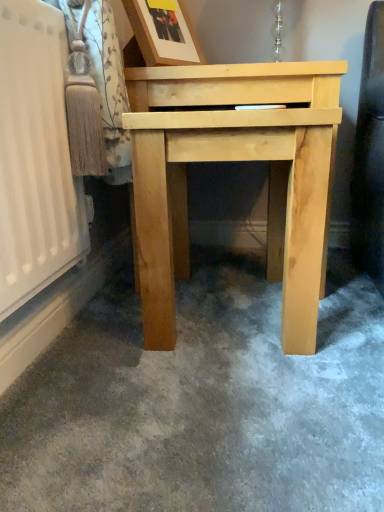
Question: In the image, is wooden picture frame at upper center positioned in front of or behind natural wood table at center?

Choices:
 (A) behind
 (B) front

Answer: (A)

Question: Is wooden picture frame at upper center inside or outside of natural wood table at center?

Choices:
 (A) outside
 (B) inside

Answer: (A)

Question: In terms of width, does wooden picture frame at upper center look wider or thinner when compared to natural wood table at center?

Choices:
 (A) thin
 (B) wide

Answer: (A)

Question: In terms of size, does natural wood table at center appear bigger or smaller than wooden picture frame at upper center?

Choices:
 (A) small
 (B) big

Answer: (B)

Question: From the image's perspective, is natural wood table at center positioned above or below wooden picture frame at upper center?

Choices:
 (A) below
 (B) above

Answer: (A)

Question: Considering the positions of point (306, 88) and point (134, 10), is point (306, 88) closer or farther from the camera than point (134, 10)?

Choices:
 (A) closer
 (B) farther

Answer: (A)

Question: Would you say natural wood table at center is inside or outside wooden picture frame at upper center?

Choices:
 (A) inside
 (B) outside

Answer: (B)